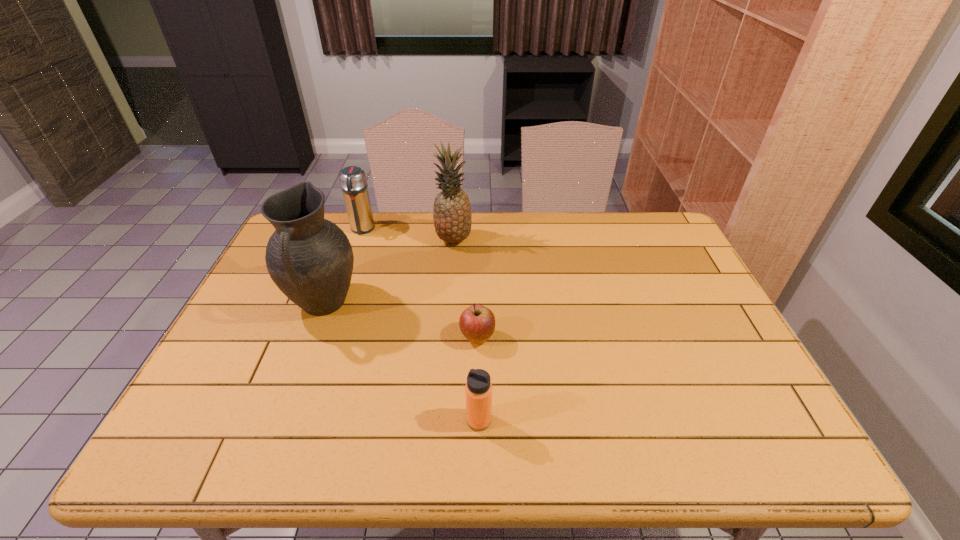
This screenshot has width=960, height=540. In order to click on object that stands as the third closest to the pineapple in this screenshot , I will do `click(477, 323)`.

The width and height of the screenshot is (960, 540). Find the location of `object that stands as the second closest to the taller thermos bottle`. object that stands as the second closest to the taller thermos bottle is located at coordinates (452, 215).

You are a GUI agent. You are given a task and a screenshot of the screen. Output one action in this format:
    pyautogui.click(x=<x>, y=<y>)
    Task: Click on the blank area in the image that satisfies the following two spatial constraints: 1. on the front side of the pineapple; 2. on the left side of the nearest object
    This screenshot has width=960, height=540.
    Given the screenshot: What is the action you would take?
    pyautogui.click(x=440, y=420)

Locate an element on the screen. The image size is (960, 540). vacant region that satisfies the following two spatial constraints: 1. with a handle on the side of the nearer thermos bottle; 2. on the left side of the third shortest object is located at coordinates (296, 420).

This screenshot has height=540, width=960. Find the location of `free space that satisfies the following two spatial constraints: 1. with a handle on the side of the left thermos bottle; 2. on the right side of the pineapple`. free space that satisfies the following two spatial constraints: 1. with a handle on the side of the left thermos bottle; 2. on the right side of the pineapple is located at coordinates (358, 240).

Where is `vacant space that satisfies the following two spatial constraints: 1. with a handle on the side of the shortest object; 2. on the left side of the taller thermos bottle`? The height and width of the screenshot is (540, 960). vacant space that satisfies the following two spatial constraints: 1. with a handle on the side of the shortest object; 2. on the left side of the taller thermos bottle is located at coordinates (324, 338).

Where is `vacant point that satisfies the following two spatial constraints: 1. with a handle on the side of the taller thermos bottle; 2. on the left side of the pineapple`? vacant point that satisfies the following two spatial constraints: 1. with a handle on the side of the taller thermos bottle; 2. on the left side of the pineapple is located at coordinates (358, 240).

I want to click on vacant space that satisfies the following two spatial constraints: 1. with a handle on the side of the apple; 2. on the left side of the farther thermos bottle, so click(x=324, y=338).

Locate an element on the screen. vacant space that satisfies the following two spatial constraints: 1. with a handle on the side of the third tallest object; 2. on the left side of the pineapple is located at coordinates (358, 240).

Locate an element on the screen. blank area in the image that satisfies the following two spatial constraints: 1. with a handle on the side of the third shortest object; 2. on the left side of the shortest object is located at coordinates (324, 338).